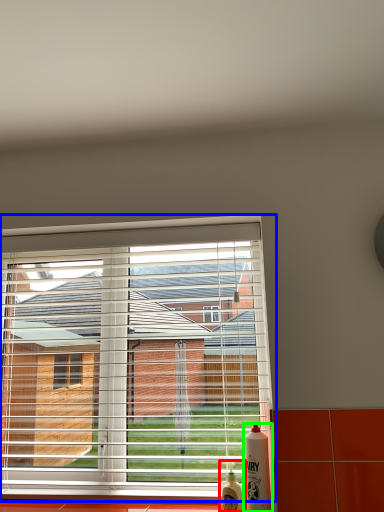
Question: Estimate the real-world distances between objects in this image. Which object is farther from bottle (highlighted by a red box), window (highlighted by a blue box) or bottle (highlighted by a green box)?

Choices:
 (A) window
 (B) bottle

Answer: (A)